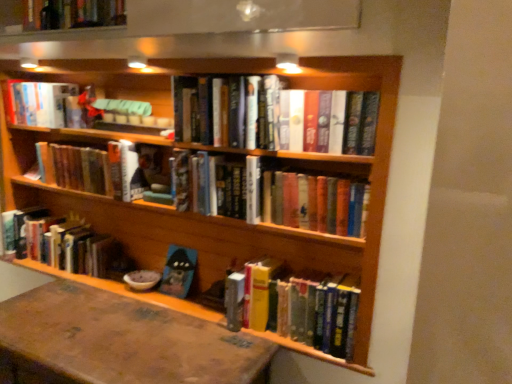
Question: From a real-world perspective, is hardcover books at center, the fifth book in the bottom-to-top sequence, above or below hardcover books at center, the fourth book positioned from the bottom?

Choices:
 (A) above
 (B) below

Answer: (A)

Question: Would you say hardcover books at center, arranged as the third book when viewed from the top, is inside or outside hardcover books at center, the fourth book positioned from the bottom?

Choices:
 (A) outside
 (B) inside

Answer: (A)

Question: Which of these objects is positioned farthest from the hardcover books at center, which is the fourth book in top-to-bottom order?

Choices:
 (A) brown leather table at lower left
 (B) hardcover books at center, acting as the second book starting from the top
 (C) hardcover books at center, marked as the 1th book in a bottom-to-top arrangement
 (D) hardcover book at upper left, which is counted as the 1th book, starting from the top
 (E) hardcover book at lower left, the 3th book from the bottom

Answer: (A)

Question: Based on their relative distances, which object is nearer to the hardcover book at lower left, the 3th book from the bottom?

Choices:
 (A) brown leather table at lower left
 (B) hardcover books at center, which is the seventh book from top to bottom
 (C) hardcover books at center, arranged as the third book when viewed from the top
 (D) matte blue book at center, which appears as the 6th book when viewed from the top
 (E) hardcover books at center, positioned as the sixth book in bottom-to-top order

Answer: (C)